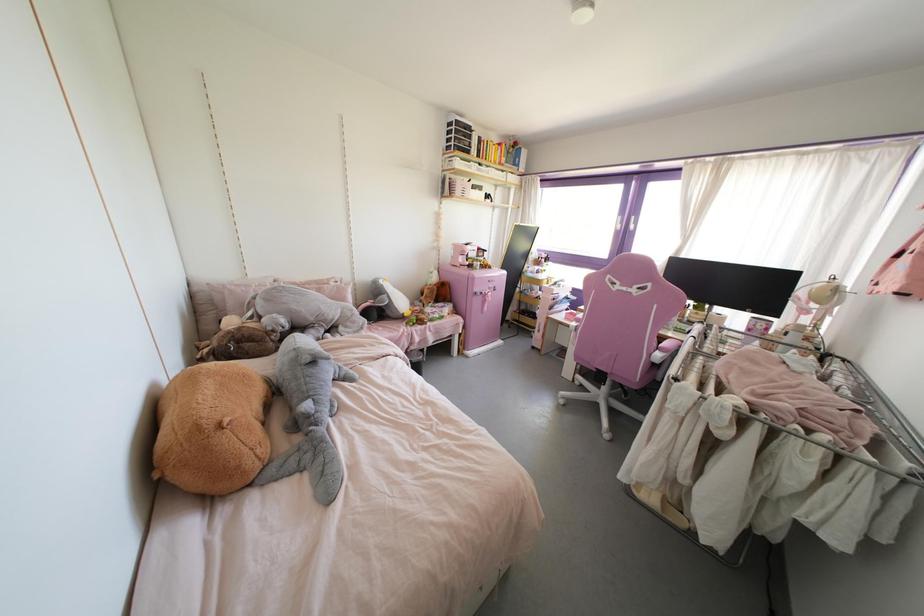
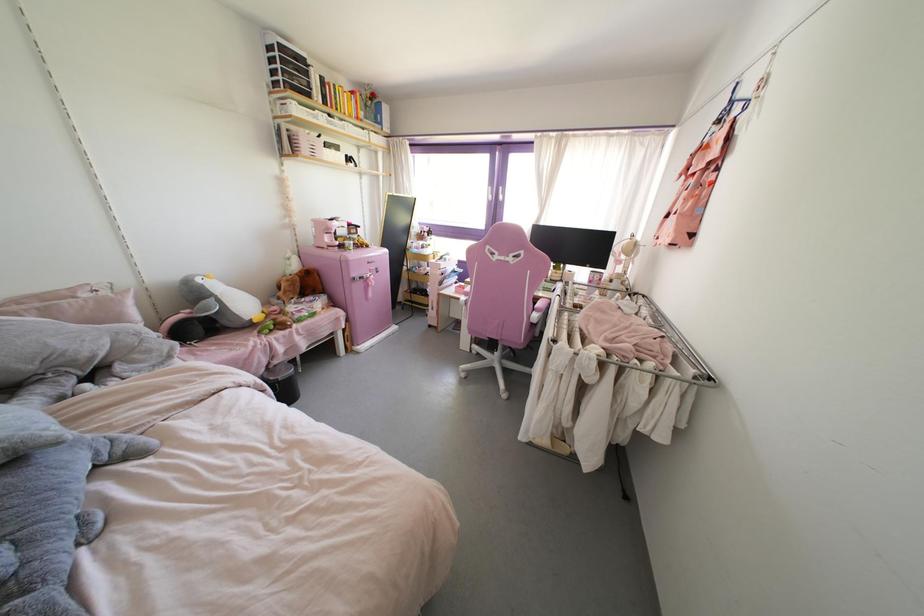
The point at (466, 355) is marked in the first image. Where is the corresponding point in the second image?

(357, 352)